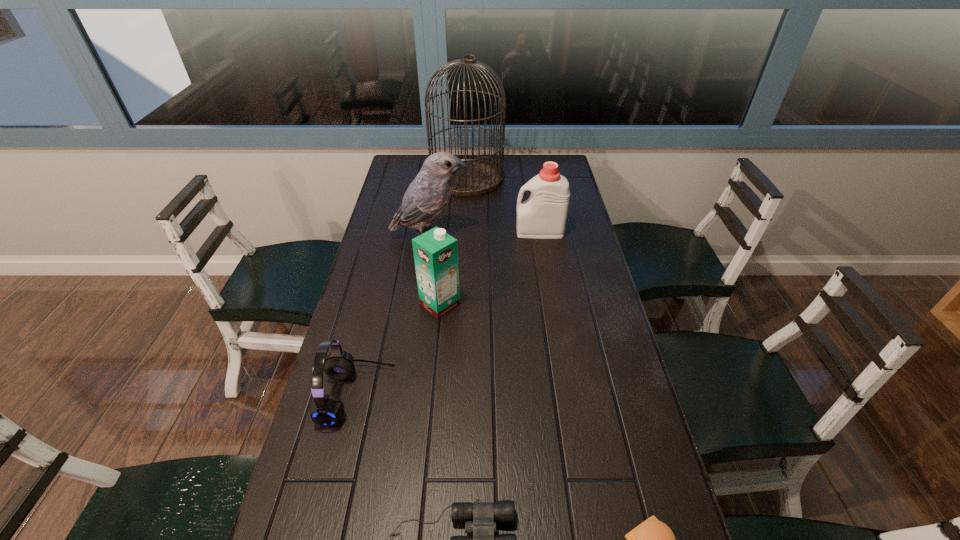
Image resolution: width=960 pixels, height=540 pixels. What are the coordinates of `free space at the far left corner of the desktop` in the screenshot? It's located at pos(394,172).

Locate an element on the screen. This screenshot has width=960, height=540. vacant point located between the tallest object and the headset is located at coordinates (412, 286).

You are a GUI agent. You are given a task and a screenshot of the screen. Output one action in this format:
    pyautogui.click(x=<x>, y=<y>)
    Task: Click on the free space between the detergent and the carton
    The width and height of the screenshot is (960, 540).
    Given the screenshot: What is the action you would take?
    pyautogui.click(x=490, y=268)

I want to click on empty space between the fourth farthest object and the third shortest object, so click(398, 350).

You are a GUI agent. You are given a task and a screenshot of the screen. Output one action in this format:
    pyautogui.click(x=<x>, y=<y>)
    Task: Click on the free spot between the parrot and the third nearest object
    
    Given the screenshot: What is the action you would take?
    pyautogui.click(x=394, y=316)

Select which object is the sixth closest to the hamburger. Please provide its 2D coordinates. Your answer should be formatted as a tuple, i.e. [(x, y)], where the tuple contains the x and y coordinates of a point satisfying the conditions above.

[(483, 175)]

Select which object is the second closest to the binoculars. Please provide its 2D coordinates. Your answer should be formatted as a tuple, i.e. [(x, y)], where the tuple contains the x and y coordinates of a point satisfying the conditions above.

[(652, 539)]

At what (x,y) coordinates should I click in order to perform the action: click on vacant space that satisfies the following two spatial constraints: 1. on the handle side of the detergent; 2. on the front side of the carton. Please return your answer as a coordinate pair (x, y). Looking at the image, I should click on (552, 305).

You are a GUI agent. You are given a task and a screenshot of the screen. Output one action in this format:
    pyautogui.click(x=<x>, y=<y>)
    Task: Click on the vacant space that satisfies the following two spatial constraints: 1. on the handle side of the detergent; 2. on the front side of the carton
    The height and width of the screenshot is (540, 960).
    Given the screenshot: What is the action you would take?
    pyautogui.click(x=552, y=305)